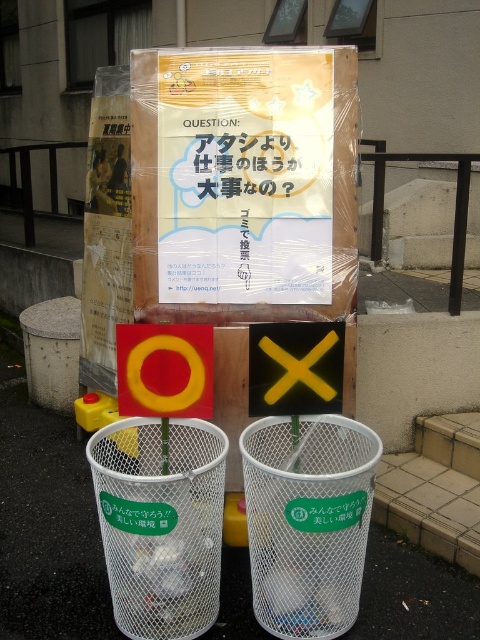
You are a waste disposal worker who needs to place a new trash bag into the bins. Which bin should you put the bag into first, the white mesh bin at lower center or the white mesh basket at center?

The white mesh bin at lower center is positioned under the white mesh basket at center, so you should place the trash bag into the white mesh bin at lower center first to avoid blocking access to the upper basket.

From the picture: You are a delivery person who needs to place a package between the white mesh basket at center and the yellow matte circle at center. The package is 14 inches long. Will it fit between them?

The distance between the white mesh basket at center and the yellow matte circle at center is 13.67 inches. Since the package is 14 inches long, it will not fit between them as it is slightly longer than the available space.

You have a rectangular object that is 30 cm wide. You want to place it on the paved surface between the white mesh basket at center and the yellow matte circle at center. Can you fit it there?

The white mesh basket at center might be wider than yellow matte circle at center, so the space between them may not be sufficient for a 30 cm wide object. Check the actual width before placing it.